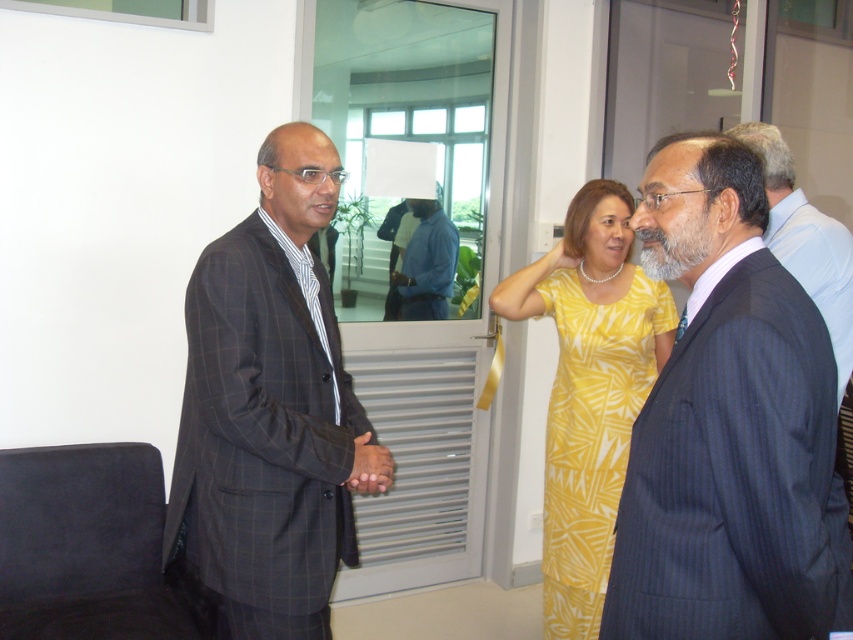
Question: Can you confirm if dark gray suit at center is thinner than blue cotton shirt at center?

Choices:
 (A) no
 (B) yes

Answer: (A)

Question: Observing the image, what is the correct spatial positioning of dark blue pinstripe suit at right in reference to dark gray suit at center?

Choices:
 (A) below
 (B) above

Answer: (A)

Question: Which point is farther to the camera?

Choices:
 (A) (828, 257)
 (B) (618, 291)
 (C) (677, 136)

Answer: (B)

Question: Which object is farther from the camera taking this photo?

Choices:
 (A) smooth skin hand at center
 (B) blue cotton shirt at center
 (C) dark blue pinstripe suit at right
 (D) dark gray checkered suit at center

Answer: (B)

Question: Can you confirm if dark gray checkered suit at center is bigger than dark gray suit at center?

Choices:
 (A) no
 (B) yes

Answer: (B)

Question: Which point appears closest to the camera in this image?

Choices:
 (A) tap(831, 260)
 (B) tap(399, 280)
 (C) tap(759, 625)
 (D) tap(585, 259)

Answer: (C)